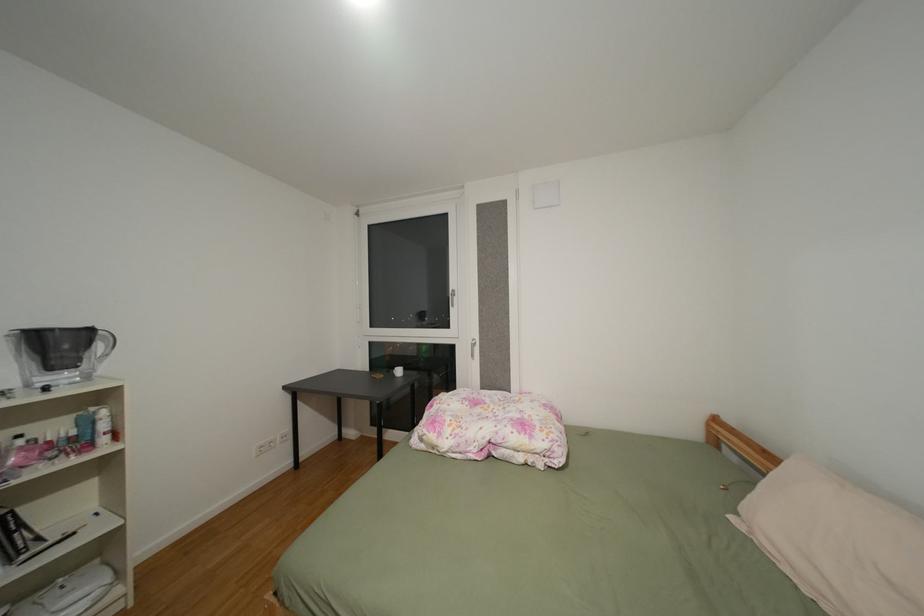
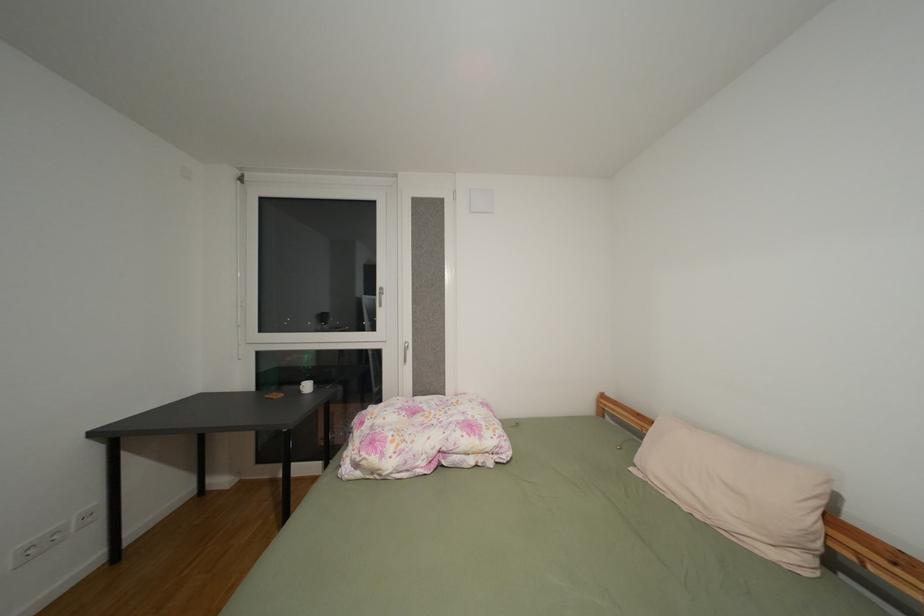
Question: The images are taken continuously from a first-person perspective. In which direction is your viewpoint rotating?

Choices:
 (A) Left
 (B) Right
 (C) Up
 (D) Down

Answer: (B)